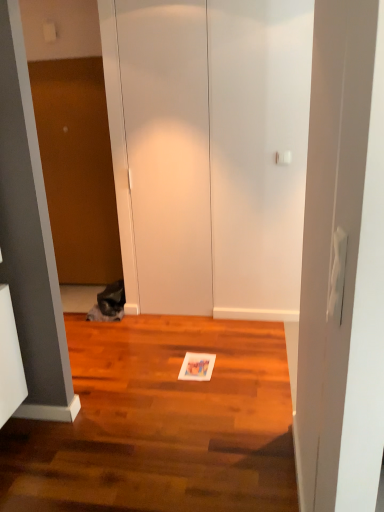
Locate an element on the screen. This screenshot has height=512, width=384. space that is in front of brown matte door at left is located at coordinates tap(80, 301).